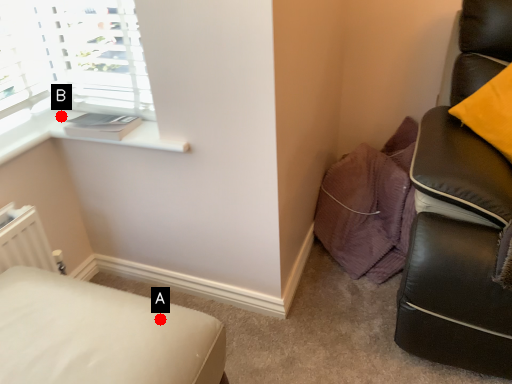
Question: Two points are circled on the image, labeled by A and B beside each circle. Which point is further to the camera?

Choices:
 (A) A is further
 (B) B is further

Answer: (B)